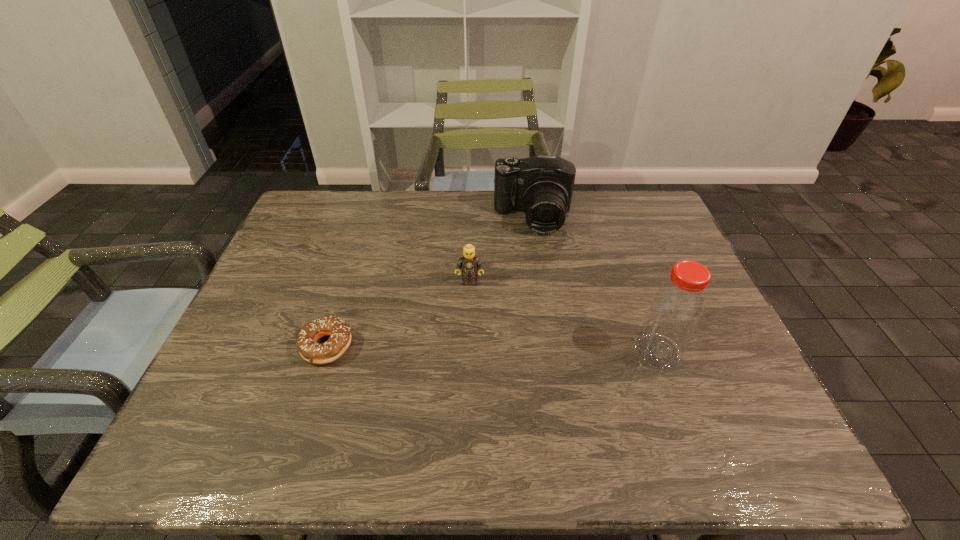
Find the location of a particular element. vacant space situated 0.180m on the lens of the farthest object is located at coordinates (532, 279).

Find the location of a particular element. The image size is (960, 540). free location located 0.070m on the lens of the farthest object is located at coordinates (532, 253).

This screenshot has width=960, height=540. Find the location of `vacant space located 0.290m on the lens of the farthest object`. vacant space located 0.290m on the lens of the farthest object is located at coordinates (531, 309).

At what (x,y) coordinates should I click in order to perform the action: click on blank space located 0.350m in front of the third tallest object. Please return your answer as a coordinate pair (x, y). Looking at the image, I should click on (464, 402).

Identify the location of blank space located 0.160m in front of the third tallest object. The height and width of the screenshot is (540, 960). (468, 332).

The width and height of the screenshot is (960, 540). What are the coordinates of `vacant space situated 0.350m in front of the third tallest object` in the screenshot? It's located at (464, 402).

I want to click on object positioned at the far edge, so click(541, 186).

Identify the location of object that is positioned at the right edge. [675, 311].

This screenshot has height=540, width=960. In the image, there is a desktop. Find the location of `vacant space at the far edge`. vacant space at the far edge is located at coordinates (404, 211).

The height and width of the screenshot is (540, 960). I want to click on vacant region at the near edge of the desktop, so click(516, 378).